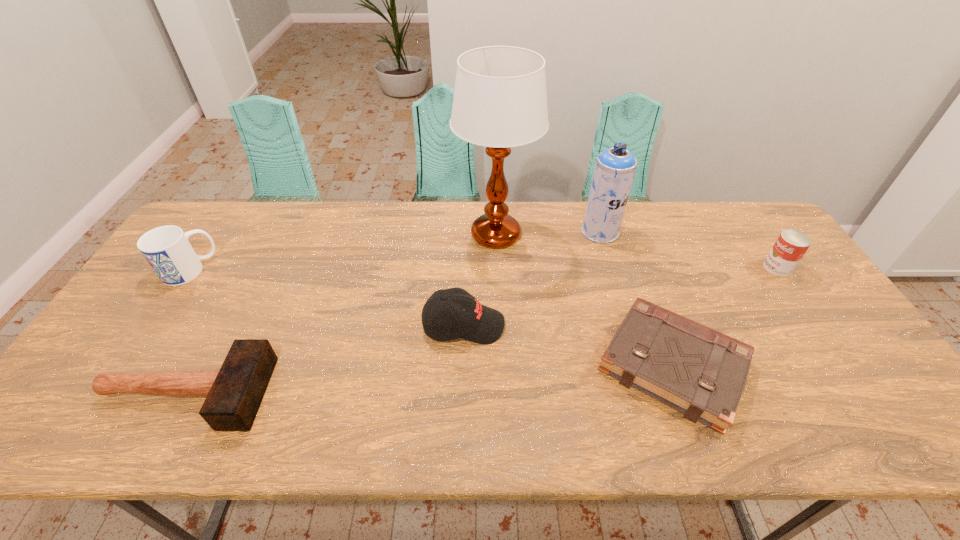
Find the location of a particular element. The width and height of the screenshot is (960, 540). free space that satisfies the following two spatial constraints: 1. on the front side of the aerosol can; 2. on the front-facing side of the baseball cap is located at coordinates (629, 325).

Identify the location of free point that satisfies the following two spatial constraints: 1. on the back side of the mug; 2. on the left side of the tallest object. This screenshot has width=960, height=540. (213, 235).

Where is `free space that satisfies the following two spatial constraints: 1. on the front side of the hardback book; 2. on the hammer head face of the mallet`? The width and height of the screenshot is (960, 540). free space that satisfies the following two spatial constraints: 1. on the front side of the hardback book; 2. on the hammer head face of the mallet is located at coordinates (682, 393).

Find the location of a particular element. The height and width of the screenshot is (540, 960). free location that satisfies the following two spatial constraints: 1. on the front-facing side of the hardback book; 2. on the right side of the baseball cap is located at coordinates (463, 366).

The height and width of the screenshot is (540, 960). I want to click on free space that satisfies the following two spatial constraints: 1. on the front-facing side of the baseball cap; 2. on the back side of the hardback book, so click(x=463, y=366).